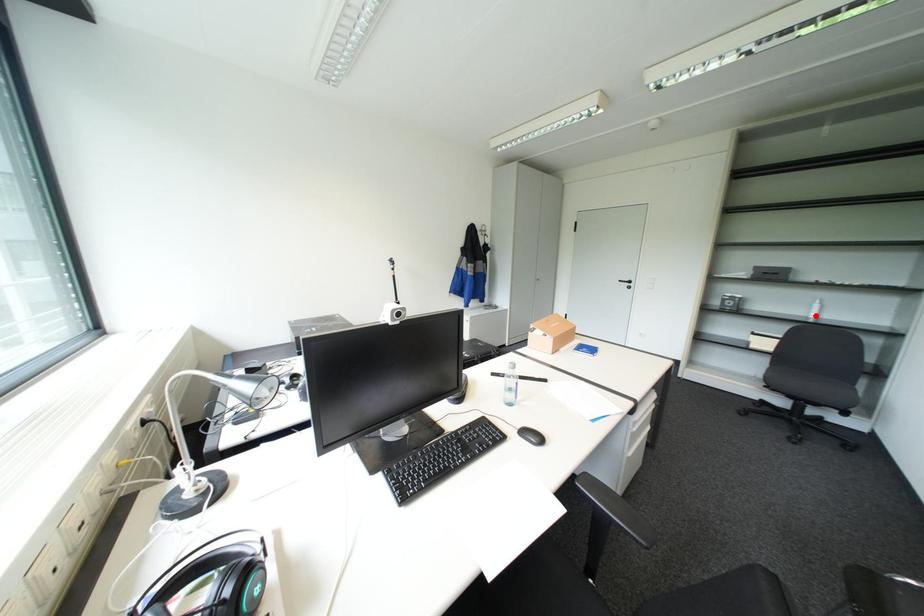
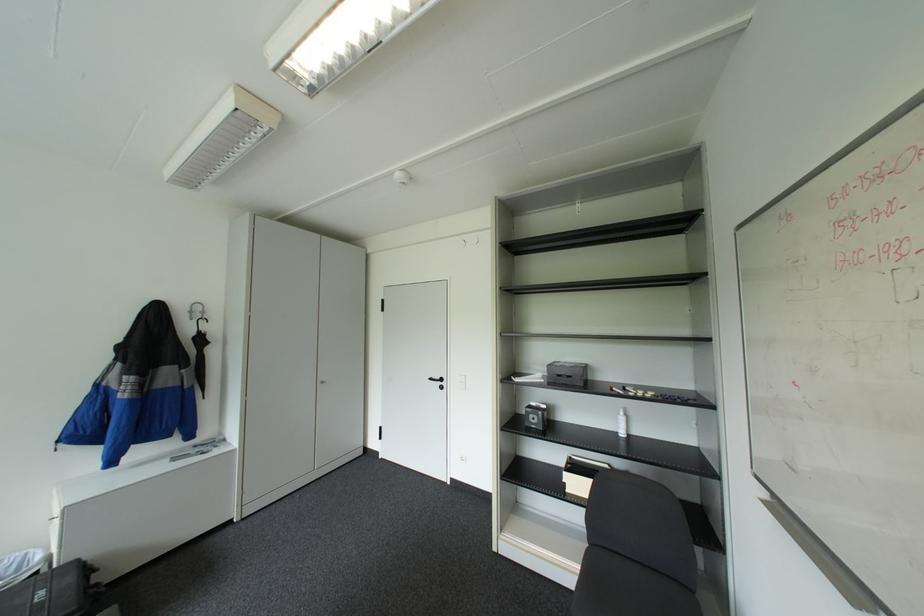
The point at the highlighted location is marked in the first image. Where is the corresponding point in the second image?

(626, 432)